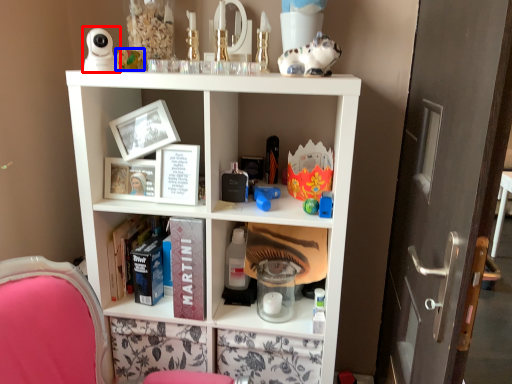
Question: Which of the following is the farthest to the observer, toy (highlighted by a red box) or toy (highlighted by a blue box)?

Choices:
 (A) toy
 (B) toy

Answer: (B)